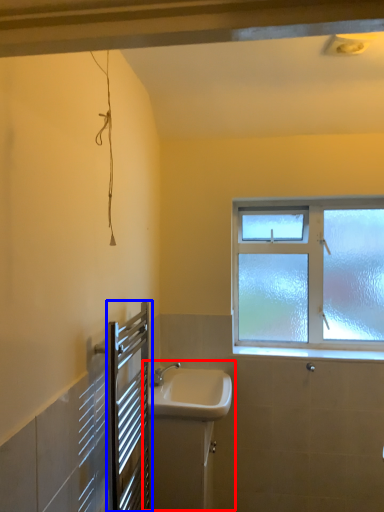
Question: Which object appears closest to the camera in this image, sink (highlighted by a red box) or screen door (highlighted by a blue box)?

Choices:
 (A) sink
 (B) screen door

Answer: (B)